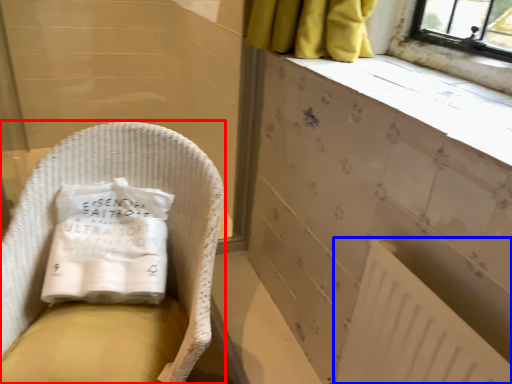
Question: Which point is closer to the camera, furniture (highlighted by a red box) or radiator (highlighted by a blue box)?

Choices:
 (A) furniture
 (B) radiator

Answer: (B)